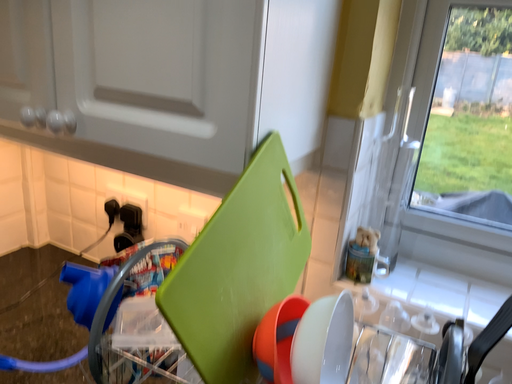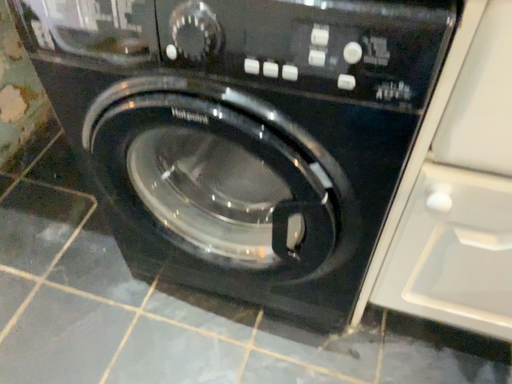
Question: Which way did the camera rotate in the video?

Choices:
 (A) rotated upward
 (B) rotated downward

Answer: (B)